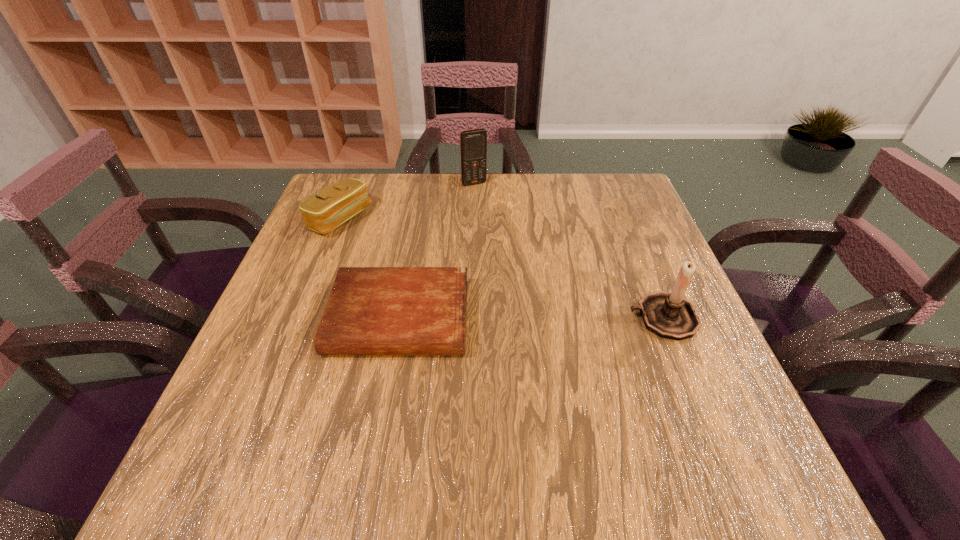
At what (x,y) coordinates should I click in order to perform the action: click on the shortest object. Please return your answer as a coordinate pair (x, y). This screenshot has width=960, height=540. Looking at the image, I should click on (371, 310).

Locate an element on the screen. This screenshot has height=540, width=960. candle holder is located at coordinates (668, 315).

Identify the location of cellular telephone. (473, 143).

Find the location of a particular element. The image size is (960, 540). clutch bag is located at coordinates (337, 203).

Locate an element on the screen. This screenshot has width=960, height=540. the third nearest object is located at coordinates (337, 203).

Where is `free space located on the spine side of the shortest object`? free space located on the spine side of the shortest object is located at coordinates (386, 391).

This screenshot has height=540, width=960. I want to click on vacant space located 0.080m on the front of the rightmost object, so click(685, 376).

Identify the location of free point located 0.270m on the screen of the farthest object. This screenshot has height=540, width=960. (512, 241).

Identify the location of vacant point located 0.370m on the screen of the farthest object. This screenshot has height=540, width=960. (527, 266).

At what (x,y) coordinates should I click in order to perform the action: click on blank space located 0.390m on the screen of the farthest object. Please return your answer as a coordinate pair (x, y). The image size is (960, 540). Looking at the image, I should click on (530, 271).